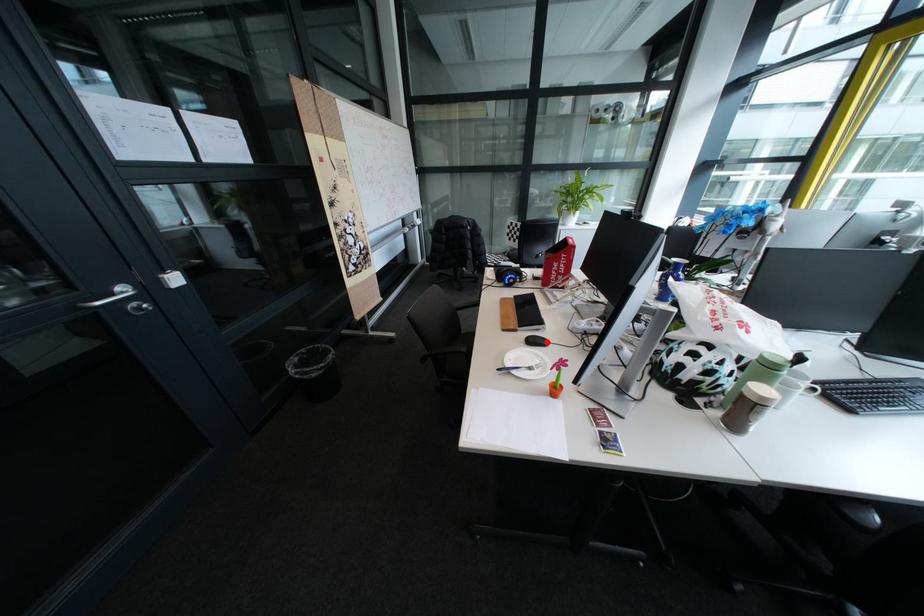
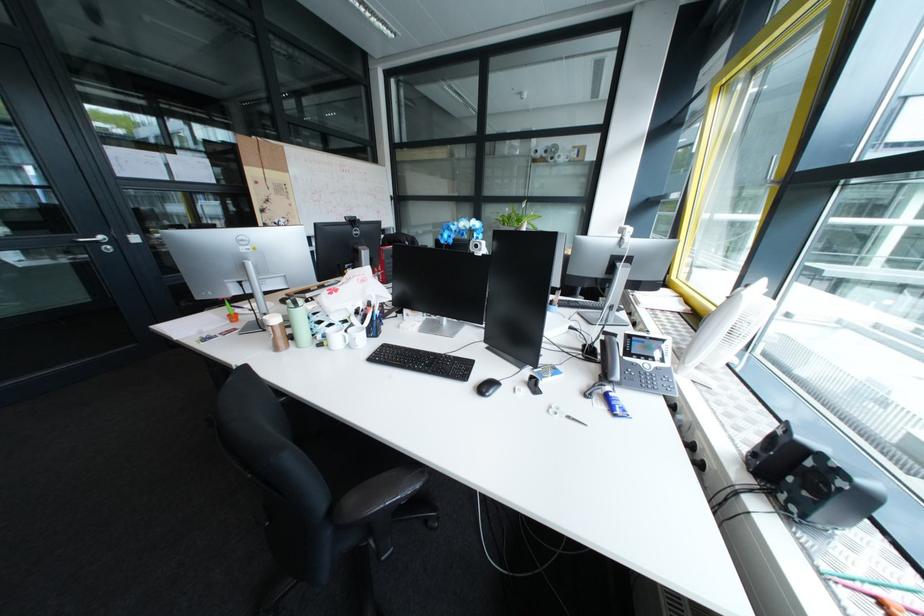
Question: I am providing you with two images of the same scene from different viewpoints. A red point is marked on the first image. At the location where the point appears in image 1, is it still visible in image 2?

Choices:
 (A) Yes
 (B) No

Answer: (B)